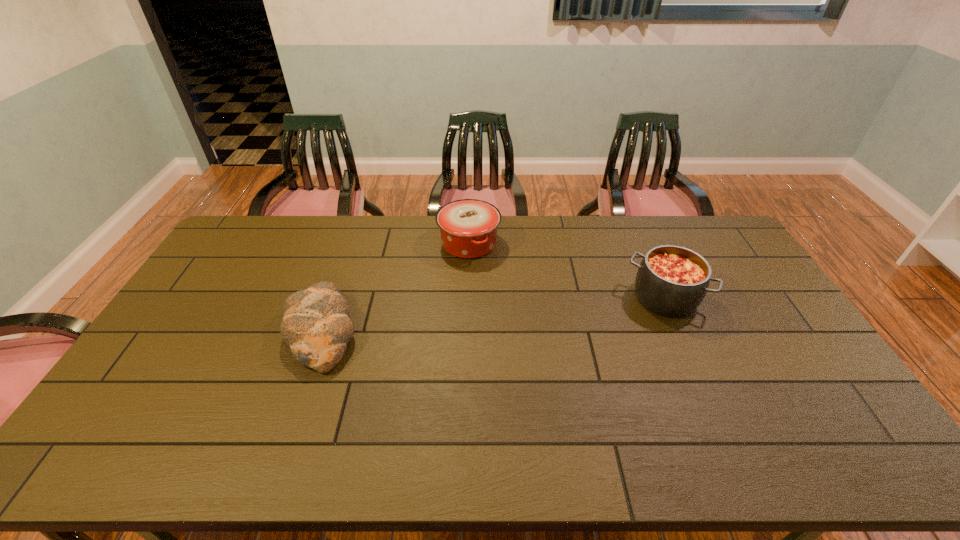
Find the location of a particular element. This screenshot has height=540, width=960. free location at the far edge of the desktop is located at coordinates (421, 239).

Locate an element on the screen. vacant space at the near edge of the desktop is located at coordinates (483, 462).

You are a GUI agent. You are given a task and a screenshot of the screen. Output one action in this format:
    pyautogui.click(x=<x>, y=<y>)
    Task: Click on the vacant point at the left edge
    
    Given the screenshot: What is the action you would take?
    pyautogui.click(x=228, y=273)

Where is `blank space at the right edge`? blank space at the right edge is located at coordinates (737, 256).

You are a GUI agent. You are given a task and a screenshot of the screen. Output one action in this format:
    pyautogui.click(x=<x>, y=<y>)
    Task: Click on the vacant space in between the right casserole and the bread
    
    Given the screenshot: What is the action you would take?
    pyautogui.click(x=493, y=315)

At what (x,y) coordinates should I click in order to perform the action: click on free spot between the shortest object and the rightmost object. Please return your answer as a coordinate pair (x, y). The height and width of the screenshot is (540, 960). Looking at the image, I should click on (493, 315).

The image size is (960, 540). I want to click on free space between the nearer casserole and the leftmost object, so click(x=493, y=315).

What are the coordinates of `vacant region between the rightmost object and the leftmost object` in the screenshot? It's located at (493, 315).

You are a GUI agent. You are given a task and a screenshot of the screen. Output one action in this format:
    pyautogui.click(x=<x>, y=<y>)
    Task: Click on the free space between the nearer casserole and the farther casserole
    This screenshot has width=960, height=540.
    Given the screenshot: What is the action you would take?
    pyautogui.click(x=567, y=271)

Locate an element on the screen. free point between the right casserole and the bread is located at coordinates (493, 315).